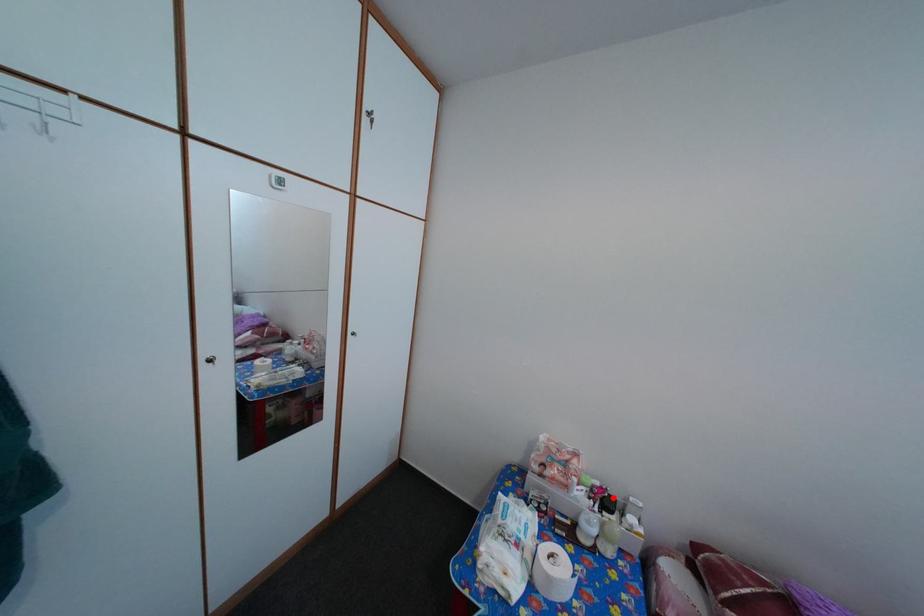
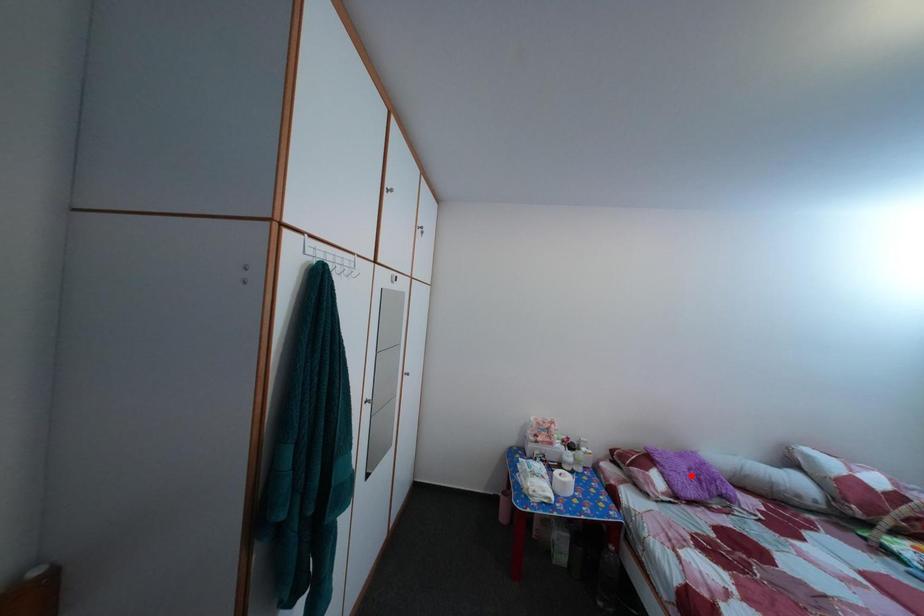
I am providing you with two images of the same scene from different viewpoints. A red point is marked on the first image and another point is marked on the second image. Is the red point in image1 aligned with the point shown in image2?

No